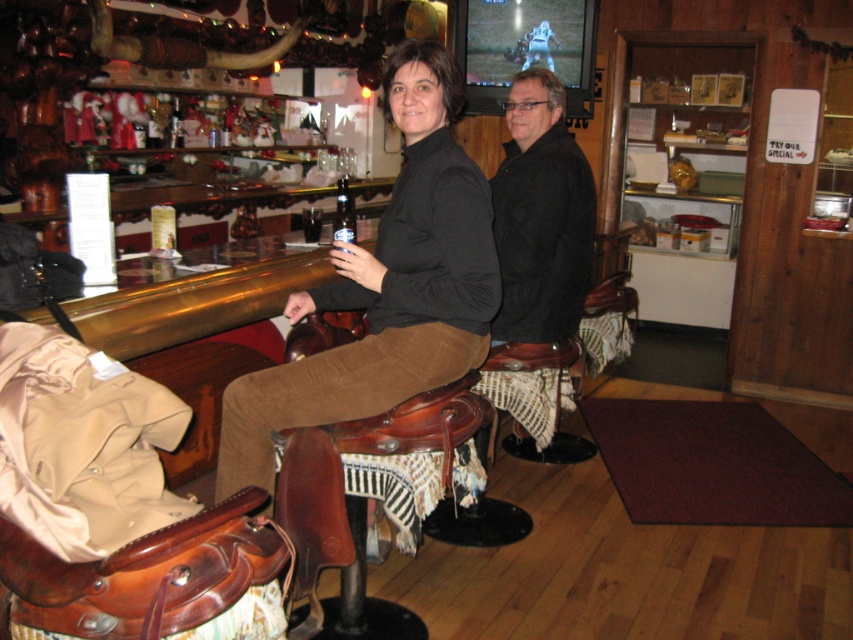
Question: Where is matte black jacket at center located in relation to black matte jacket at center in the image?

Choices:
 (A) left
 (B) right

Answer: (A)

Question: Is black matte jacket at center above clear glass bottle at center?

Choices:
 (A) no
 (B) yes

Answer: (B)

Question: Which object is closer to the camera taking this photo?

Choices:
 (A) matte black jacket at center
 (B) black matte jacket at center
 (C) clear glass bottle at center

Answer: (A)

Question: Does black matte jacket at center have a lesser width compared to clear glass bottle at center?

Choices:
 (A) yes
 (B) no

Answer: (B)

Question: Which point appears closest to the camera in this image?

Choices:
 (A) (354, 234)
 (B) (550, 176)

Answer: (A)

Question: Which object is farther from the camera taking this photo?

Choices:
 (A) matte black jacket at center
 (B) clear glass bottle at center
 (C) black matte jacket at center

Answer: (C)